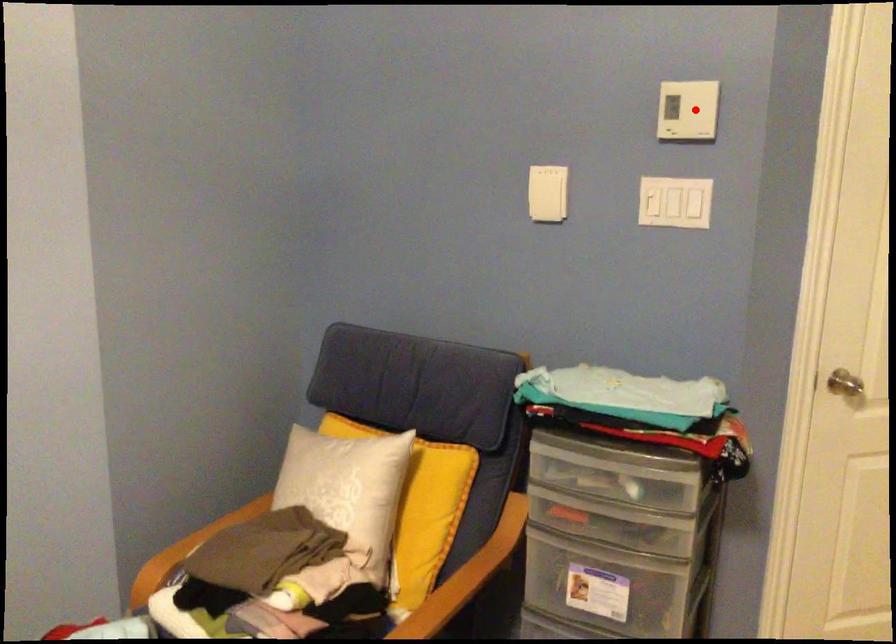
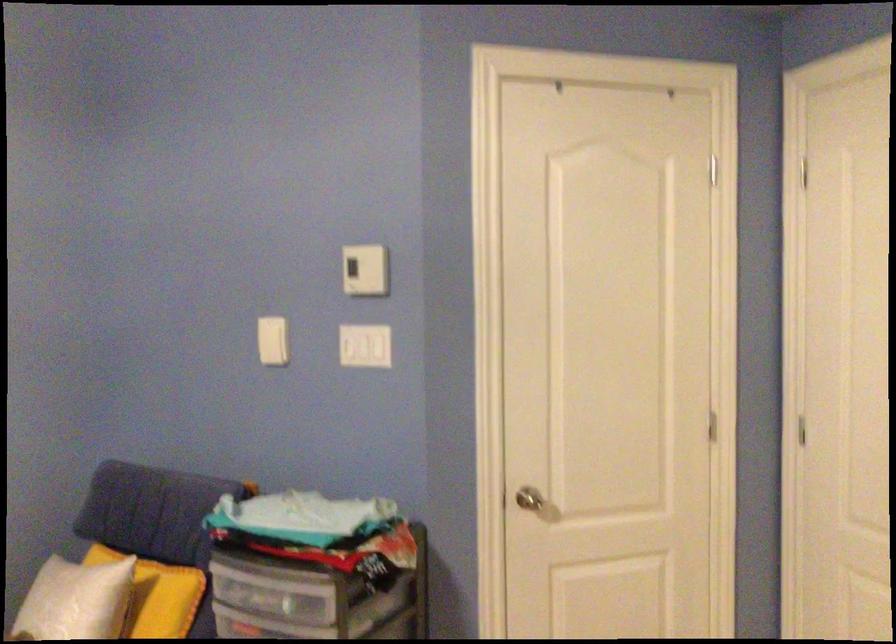
In the second image, find the point that corresponds to the highlighted location in the first image.

(365, 270)